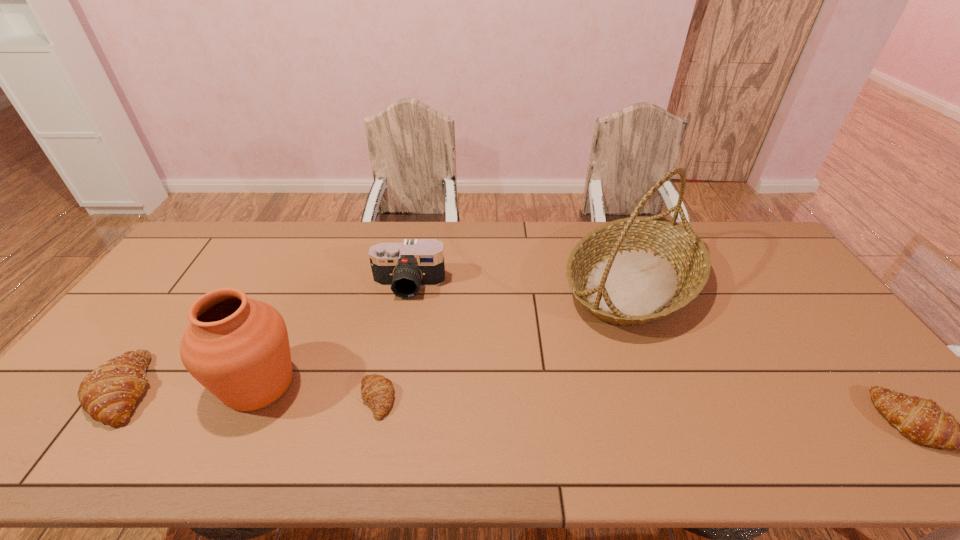
Where is `vacant space situated 0.220m on the left of the tallest object`? This screenshot has width=960, height=540. vacant space situated 0.220m on the left of the tallest object is located at coordinates (491, 283).

At what (x,y) coordinates should I click in order to perform the action: click on vacant space located on the front-facing side of the fourth shortest object. Please return your answer as a coordinate pair (x, y). The height and width of the screenshot is (540, 960). Looking at the image, I should click on (398, 346).

Where is `free location located on the left of the second object from left to right`? This screenshot has width=960, height=540. free location located on the left of the second object from left to right is located at coordinates (141, 384).

At what (x,y) coordinates should I click in order to perform the action: click on object at the far edge. Please return your answer as a coordinate pair (x, y). Looking at the image, I should click on (633, 271).

At what (x,y) coordinates should I click in order to perform the action: click on urn that is at the near edge. Please return your answer as a coordinate pair (x, y). This screenshot has height=540, width=960. Looking at the image, I should click on (238, 348).

Find the location of a particular element. This screenshot has width=960, height=540. object present at the left edge is located at coordinates (108, 394).

Where is `object that is positioned at the near left corner`? object that is positioned at the near left corner is located at coordinates (108, 394).

Find the location of a particular element. free spot at the far edge of the desktop is located at coordinates (460, 254).

What are the coordinates of `free space at the near edge of the desktop` in the screenshot? It's located at (434, 393).

Locate an element on the screen. free space at the left edge of the desktop is located at coordinates (179, 274).